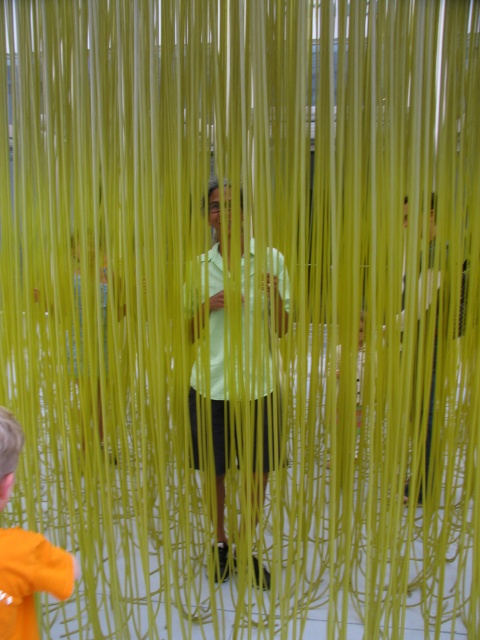
Does light green fabric shirt at center have a greater width compared to orange fabric at lower left?

Indeed, light green fabric shirt at center has a greater width compared to orange fabric at lower left.

Locate an element on the screen. This screenshot has width=480, height=640. light green fabric shirt at center is located at coordinates (237, 344).

Can you confirm if light green fabric at center is positioned above orange fabric at lower left?

Yes.

Between point (213, 257) and point (21, 595), which one is positioned in front?

Point (21, 595) is more forward.

Is point (264, 433) positioned before point (21, 429)?

No, it is behind (21, 429).

The height and width of the screenshot is (640, 480). What are the coordinates of `light green fabric at center` in the screenshot? It's located at (236, 356).

Who is positioned more to the right, light green fabric at center or light green fabric shirt at center?

From the viewer's perspective, light green fabric at center appears more on the right side.

At what (x,y) coordinates should I click in order to perform the action: click on light green fabric at center. Please return your answer as a coordinate pair (x, y). Image resolution: width=480 pixels, height=640 pixels. Looking at the image, I should click on (236, 356).